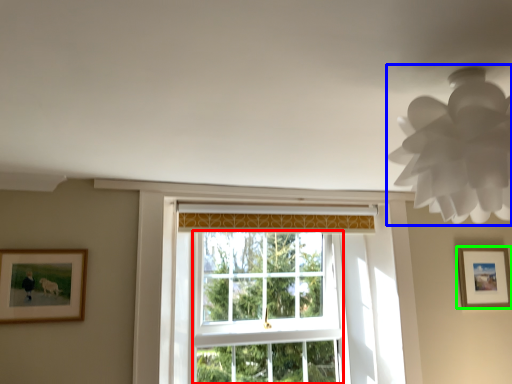
Question: Considering the real-world distances, which object is farthest from bay window (highlighted by a red box)? lamp (highlighted by a blue box) or picture frame (highlighted by a green box)?

Choices:
 (A) lamp
 (B) picture frame

Answer: (A)